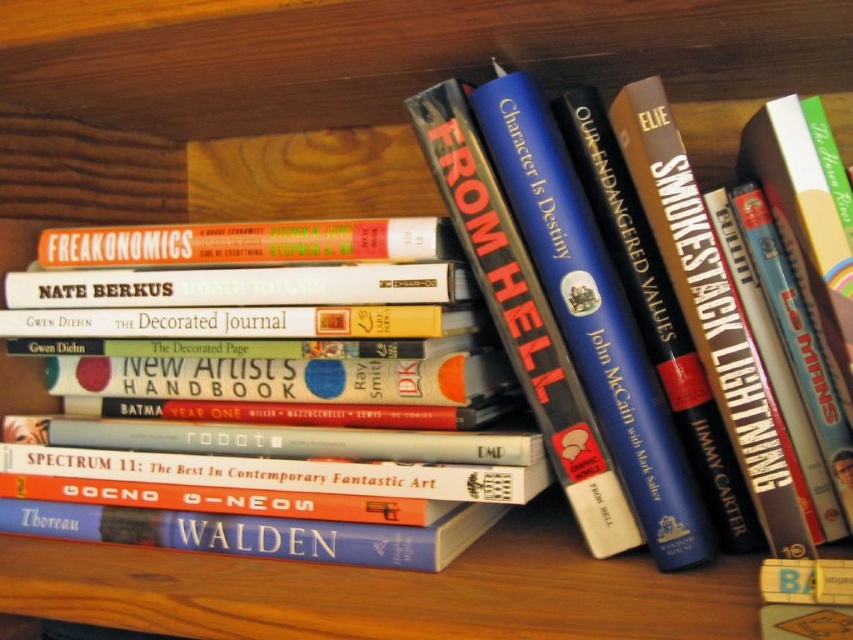
Which of these two, blue hardcover book at center or hardcover book at center, stands shorter?

hardcover book at center is shorter.

Is blue hardcover book at center bigger than hardcover book at center?

Indeed, blue hardcover book at center has a larger size compared to hardcover book at center.

Between point (497, 320) and point (7, 220), which one is positioned in front?

Point (497, 320) is more forward.

Find the location of `blue hardcover book at center`. blue hardcover book at center is located at coordinates (521, 316).

Is blue hardcover book at center to the right of orange matte hardcover book at center from the viewer's perspective?

Correct, you'll find blue hardcover book at center to the right of orange matte hardcover book at center.

Locate an element on the screen. The image size is (853, 640). blue hardcover book at center is located at coordinates (521, 316).

Describe the element at coordinates (521, 316) in the screenshot. The image size is (853, 640). I see `blue hardcover book at center` at that location.

Identify the location of blue hardcover book at center. The height and width of the screenshot is (640, 853). (521, 316).

Who is shorter, orange matte hardcover book at center or hardcover book at center?

Standing shorter between the two is orange matte hardcover book at center.

Does point (361, 234) lie in front of point (49, 412)?

Yes, point (361, 234) is in front of point (49, 412).

I want to click on orange matte hardcover book at center, so click(x=251, y=243).